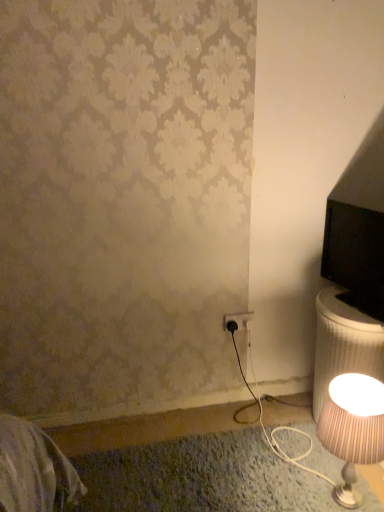
Question: Does black plastic outlet at lower center contain striped fabric lampshade at lower right?

Choices:
 (A) no
 (B) yes

Answer: (A)

Question: From the image's perspective, is black plastic outlet at lower center located above striped fabric lampshade at lower right?

Choices:
 (A) no
 (B) yes

Answer: (B)

Question: Considering the relative sizes of black plastic outlet at lower center and striped fabric lampshade at lower right in the image provided, is black plastic outlet at lower center taller than striped fabric lampshade at lower right?

Choices:
 (A) no
 (B) yes

Answer: (A)

Question: Can you confirm if black plastic outlet at lower center is bigger than striped fabric lampshade at lower right?

Choices:
 (A) no
 (B) yes

Answer: (A)

Question: From a real-world perspective, is black plastic outlet at lower center beneath striped fabric lampshade at lower right?

Choices:
 (A) no
 (B) yes

Answer: (A)

Question: Is the position of black plastic outlet at lower center less distant than that of striped fabric lampshade at lower right?

Choices:
 (A) no
 (B) yes

Answer: (A)

Question: From a real-world perspective, does striped fabric lampshade at lower right sit lower than black plastic outlet at lower center?

Choices:
 (A) no
 (B) yes

Answer: (B)

Question: Is striped fabric lampshade at lower right at the left side of black plastic outlet at lower center?

Choices:
 (A) no
 (B) yes

Answer: (A)

Question: Is striped fabric lampshade at lower right thinner than black plastic outlet at lower center?

Choices:
 (A) no
 (B) yes

Answer: (A)

Question: Does striped fabric lampshade at lower right have a larger size compared to black plastic outlet at lower center?

Choices:
 (A) yes
 (B) no

Answer: (A)

Question: Does striped fabric lampshade at lower right have a lesser height compared to black plastic outlet at lower center?

Choices:
 (A) yes
 (B) no

Answer: (B)

Question: Does striped fabric lampshade at lower right have a smaller size compared to black plastic outlet at lower center?

Choices:
 (A) no
 (B) yes

Answer: (A)

Question: Considering the positions of striped fabric lampshade at lower right and black plastic outlet at lower center in the image, is striped fabric lampshade at lower right bigger or smaller than black plastic outlet at lower center?

Choices:
 (A) big
 (B) small

Answer: (A)